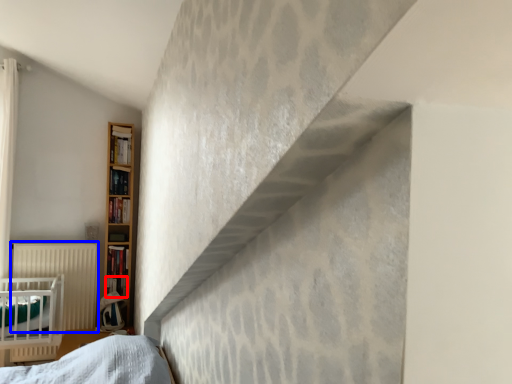
Question: Which point is further to the camera, book (highlighted by a red box) or radiator (highlighted by a blue box)?

Choices:
 (A) book
 (B) radiator

Answer: (A)